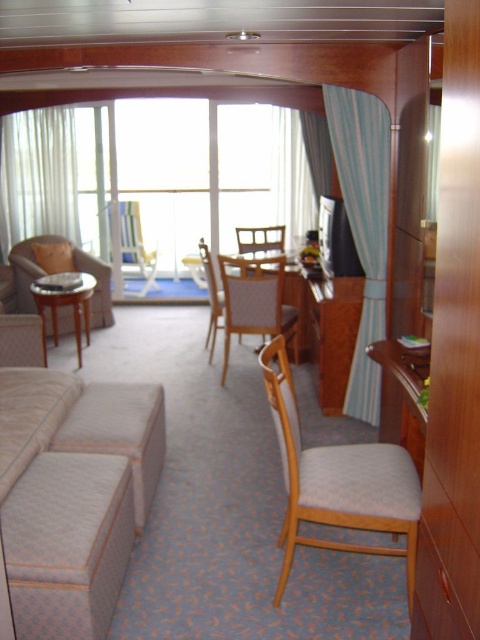
You are sitting on the sofa and want to reach the dining table. Which chair, the light beige fabric chair at center or the light beige fabric armchair at center, is closer to you?

The light beige fabric chair at center is closer to the viewer than the light beige fabric armchair at center, so the light beige fabric chair at center is closer to you.

You are planning to hang a large painting that requires a wide space. Based on the scene, which object between the white sheer curtains at left and the light beige fabric armchair at center would you consider for placement, and why?

The white sheer curtains at left is larger in size than the light beige fabric armchair at center, so the white sheer curtains at left would provide more space to accommodate the large painting.